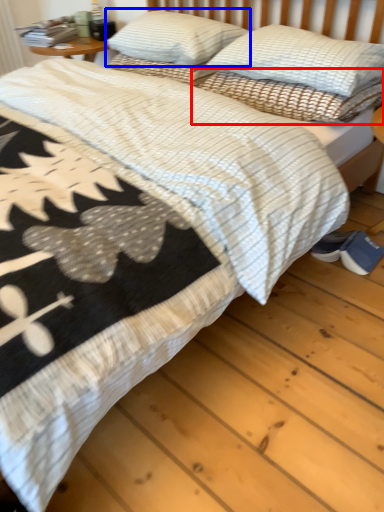
Question: Which of the following is the farthest to the observer, pillow (highlighted by a red box) or pillow (highlighted by a blue box)?

Choices:
 (A) pillow
 (B) pillow

Answer: (B)